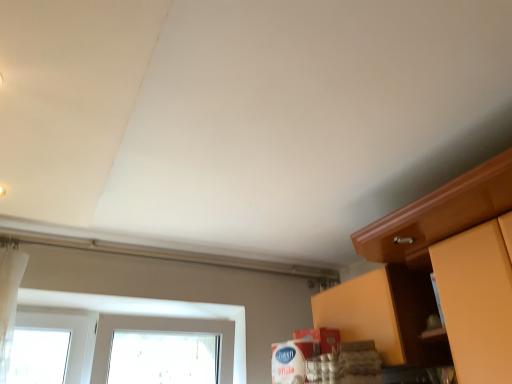
What do you see at coordinates (362, 313) in the screenshot? This screenshot has height=384, width=512. I see `matte wood cabinet at lower right, positioned as the second cabinetry in front-to-back order` at bounding box center [362, 313].

I want to click on matte wood cabinet at lower right, the first cabinetry from the back, so click(x=362, y=313).

The image size is (512, 384). Describe the element at coordinates (477, 299) in the screenshot. I see `matte wood cabinet at right, the 2th cabinetry viewed from the back` at that location.

Where is `matte wood cabinet at right, which is counted as the 1th cabinetry, starting from the front`? The image size is (512, 384). matte wood cabinet at right, which is counted as the 1th cabinetry, starting from the front is located at coordinates (477, 299).

In order to click on matte wood cabinet at lower right, the first cabinetry from the back in this screenshot , I will do `click(362, 313)`.

Considering the positions of objects matte wood cabinet at lower right, the first cabinetry from the back, and matte wood cabinet at right, which is counted as the 1th cabinetry, starting from the front, in the image provided, who is more to the right, matte wood cabinet at lower right, the first cabinetry from the back, or matte wood cabinet at right, which is counted as the 1th cabinetry, starting from the front,?

From the viewer's perspective, matte wood cabinet at right, which is counted as the 1th cabinetry, starting from the front, appears more on the right side.

Does matte wood cabinet at lower right, the first cabinetry from the back, lie behind matte wood cabinet at right, the 2th cabinetry viewed from the back?

Yes.

Between point (376, 324) and point (498, 333), which one is positioned in front?

The point (498, 333) is closer.

From the image's perspective, would you say matte wood cabinet at lower right, positioned as the second cabinetry in front-to-back order, is shown under matte wood cabinet at right, which is counted as the 1th cabinetry, starting from the front?

Yes.

From a real-world perspective, which object stands above the other?

matte wood cabinet at lower right, the first cabinetry from the back, is physically above.

Considering the relative sizes of matte wood cabinet at lower right, positioned as the second cabinetry in front-to-back order, and matte wood cabinet at right, the 2th cabinetry viewed from the back, in the image provided, is matte wood cabinet at lower right, positioned as the second cabinetry in front-to-back order, thinner than matte wood cabinet at right, the 2th cabinetry viewed from the back,?

Indeed, matte wood cabinet at lower right, positioned as the second cabinetry in front-to-back order, has a lesser width compared to matte wood cabinet at right, the 2th cabinetry viewed from the back.

In terms of height, does matte wood cabinet at lower right, the first cabinetry from the back, look taller or shorter compared to matte wood cabinet at right, the 2th cabinetry viewed from the back?

Clearly, matte wood cabinet at lower right, the first cabinetry from the back, is shorter compared to matte wood cabinet at right, the 2th cabinetry viewed from the back.

Considering the sizes of matte wood cabinet at lower right, the first cabinetry from the back, and matte wood cabinet at right, the 2th cabinetry viewed from the back, in the image, is matte wood cabinet at lower right, the first cabinetry from the back, bigger or smaller than matte wood cabinet at right, the 2th cabinetry viewed from the back,?

Considering their sizes, matte wood cabinet at lower right, the first cabinetry from the back, takes up more space than matte wood cabinet at right, the 2th cabinetry viewed from the back.

Is matte wood cabinet at lower right, the first cabinetry from the back, spatially inside matte wood cabinet at right, the 2th cabinetry viewed from the back, or outside of it?

The correct answer is: outside.

Are matte wood cabinet at lower right, the first cabinetry from the back, and matte wood cabinet at right, the 2th cabinetry viewed from the back, far apart?

That's not correct — matte wood cabinet at lower right, the first cabinetry from the back, is a little close to matte wood cabinet at right, the 2th cabinetry viewed from the back.

Is matte wood cabinet at lower right, the first cabinetry from the back, oriented towards matte wood cabinet at right, which is counted as the 1th cabinetry, starting from the front?

No, matte wood cabinet at lower right, the first cabinetry from the back, is not aimed at matte wood cabinet at right, which is counted as the 1th cabinetry, starting from the front.

How many degrees apart are the facing directions of matte wood cabinet at lower right, the first cabinetry from the back, and matte wood cabinet at right, the 2th cabinetry viewed from the back?

The facing directions of matte wood cabinet at lower right, the first cabinetry from the back, and matte wood cabinet at right, the 2th cabinetry viewed from the back, are 3.53e-05 degrees apart.

There is a matte wood cabinet at right, which is counted as the 1th cabinetry, starting from the front. Identify the location of cabinetry above it (from a real-world perspective). (362, 313).

Visually, is matte wood cabinet at right, the 2th cabinetry viewed from the back, positioned to the left or to the right of matte wood cabinet at lower right, positioned as the second cabinetry in front-to-back order?

Based on their positions, matte wood cabinet at right, the 2th cabinetry viewed from the back, is located to the right of matte wood cabinet at lower right, positioned as the second cabinetry in front-to-back order.

Is matte wood cabinet at right, which is counted as the 1th cabinetry, starting from the front, in front of matte wood cabinet at lower right, the first cabinetry from the back?

That is True.

Is point (472, 238) closer to viewer compared to point (375, 298)?

Yes, it is.

From the image's perspective, which one is positioned lower, matte wood cabinet at right, which is counted as the 1th cabinetry, starting from the front, or matte wood cabinet at lower right, positioned as the second cabinetry in front-to-back order?

matte wood cabinet at lower right, positioned as the second cabinetry in front-to-back order, from the image's perspective.

From a real-world perspective, is matte wood cabinet at right, the 2th cabinetry viewed from the back, physically below matte wood cabinet at lower right, positioned as the second cabinetry in front-to-back order?

Yes, from a real-world perspective, matte wood cabinet at right, the 2th cabinetry viewed from the back, is under matte wood cabinet at lower right, positioned as the second cabinetry in front-to-back order.

Does matte wood cabinet at right, which is counted as the 1th cabinetry, starting from the front, have a lesser width compared to matte wood cabinet at lower right, the first cabinetry from the back?

In fact, matte wood cabinet at right, which is counted as the 1th cabinetry, starting from the front, might be wider than matte wood cabinet at lower right, the first cabinetry from the back.

Between matte wood cabinet at right, the 2th cabinetry viewed from the back, and matte wood cabinet at lower right, positioned as the second cabinetry in front-to-back order, which one has more height?

matte wood cabinet at right, the 2th cabinetry viewed from the back.

Looking at the image, does matte wood cabinet at right, the 2th cabinetry viewed from the back, seem bigger or smaller compared to matte wood cabinet at lower right, the first cabinetry from the back?

Clearly, matte wood cabinet at right, the 2th cabinetry viewed from the back, is smaller in size than matte wood cabinet at lower right, the first cabinetry from the back.

Would you say matte wood cabinet at right, which is counted as the 1th cabinetry, starting from the front, is outside matte wood cabinet at lower right, the first cabinetry from the back?

Indeed, matte wood cabinet at right, which is counted as the 1th cabinetry, starting from the front, is completely outside matte wood cabinet at lower right, the first cabinetry from the back.

Are matte wood cabinet at right, which is counted as the 1th cabinetry, starting from the front, and matte wood cabinet at lower right, the first cabinetry from the back, located far from each other?

No, matte wood cabinet at right, which is counted as the 1th cabinetry, starting from the front, is in close proximity to matte wood cabinet at lower right, the first cabinetry from the back.

Does matte wood cabinet at right, the 2th cabinetry viewed from the back, turn towards matte wood cabinet at lower right, positioned as the second cabinetry in front-to-back order?

No, matte wood cabinet at right, the 2th cabinetry viewed from the back, is not turned towards matte wood cabinet at lower right, positioned as the second cabinetry in front-to-back order.

What's the angular difference between matte wood cabinet at right, which is counted as the 1th cabinetry, starting from the front, and matte wood cabinet at lower right, the first cabinetry from the back,'s facing directions?

They differ by 3.53e-05 degrees in their facing directions.

How far apart are matte wood cabinet at right, the 2th cabinetry viewed from the back, and matte wood cabinet at lower right, positioned as the second cabinetry in front-to-back order?

43.34 centimeters.

Where is `cabinetry that appears below the matte wood cabinet at lower right, the first cabinetry from the back (from a real-world perspective)`? cabinetry that appears below the matte wood cabinet at lower right, the first cabinetry from the back (from a real-world perspective) is located at coordinates (477, 299).

What are the coordinates of `cabinetry above the matte wood cabinet at lower right, positioned as the second cabinetry in front-to-back order (from the image's perspective)` in the screenshot? It's located at (477, 299).

At what (x,y) coordinates should I click in order to perform the action: click on cabinetry above the matte wood cabinet at right, the 2th cabinetry viewed from the back (from a real-world perspective). Please return your answer as a coordinate pair (x, y). This screenshot has height=384, width=512. Looking at the image, I should click on (362, 313).